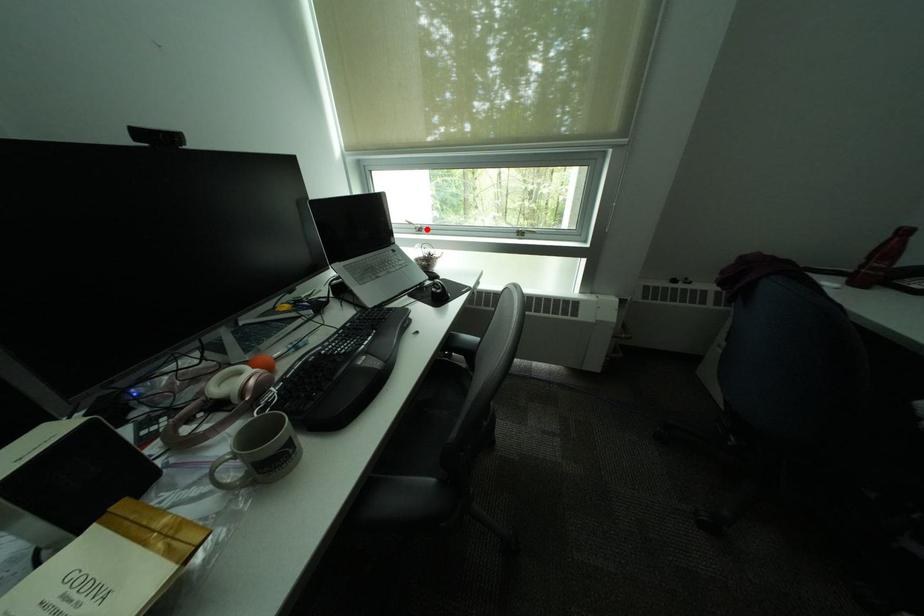
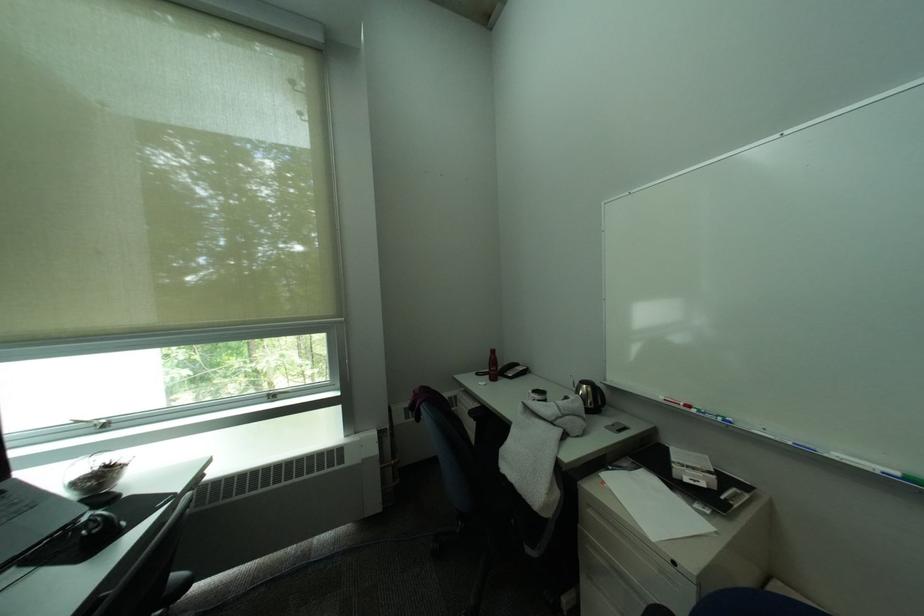
Find the pixel in the second image that matches the highlighted location in the first image.

(106, 427)